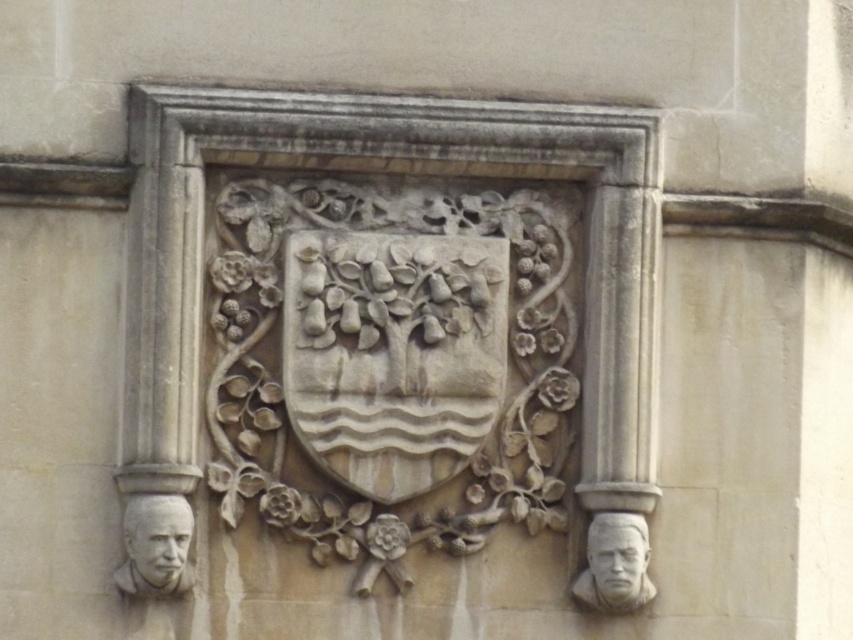
Between gray stone bust at lower left and stone carved face at lower right, which one appears on the left side from the viewer's perspective?

From the viewer's perspective, gray stone bust at lower left appears more on the left side.

The height and width of the screenshot is (640, 853). I want to click on gray stone bust at lower left, so click(x=155, y=547).

Looking at this image, who is positioned more to the right, stone carved face at lower right or gray stone face at lower left?

stone carved face at lower right is more to the right.

Does point (619, 516) come behind point (167, 566)?

Yes, point (619, 516) is farther from viewer.

Identify the location of stone carved face at lower right. The image size is (853, 640). (618, 556).

Measure the distance from gray stone bust at lower left to gray stone bust at lower right.

gray stone bust at lower left and gray stone bust at lower right are 15.61 feet apart from each other.

Is gray stone bust at lower left further to camera compared to gray stone bust at lower right?

No, it is in front of gray stone bust at lower right.

Measure the distance between gray stone bust at lower left and camera.

The distance of gray stone bust at lower left from camera is 36.34 meters.

This screenshot has width=853, height=640. Find the location of `gray stone bust at lower left`. gray stone bust at lower left is located at coordinates (155, 547).